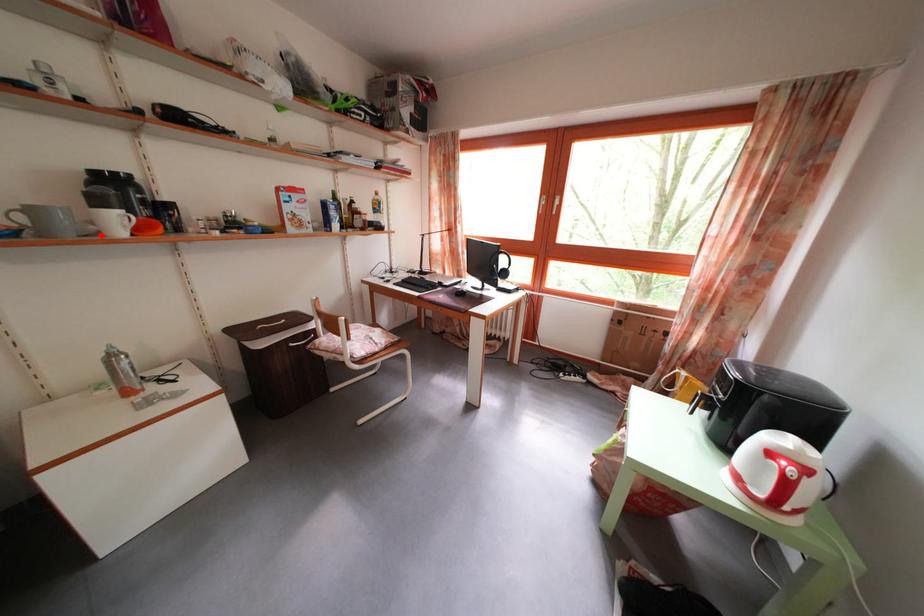
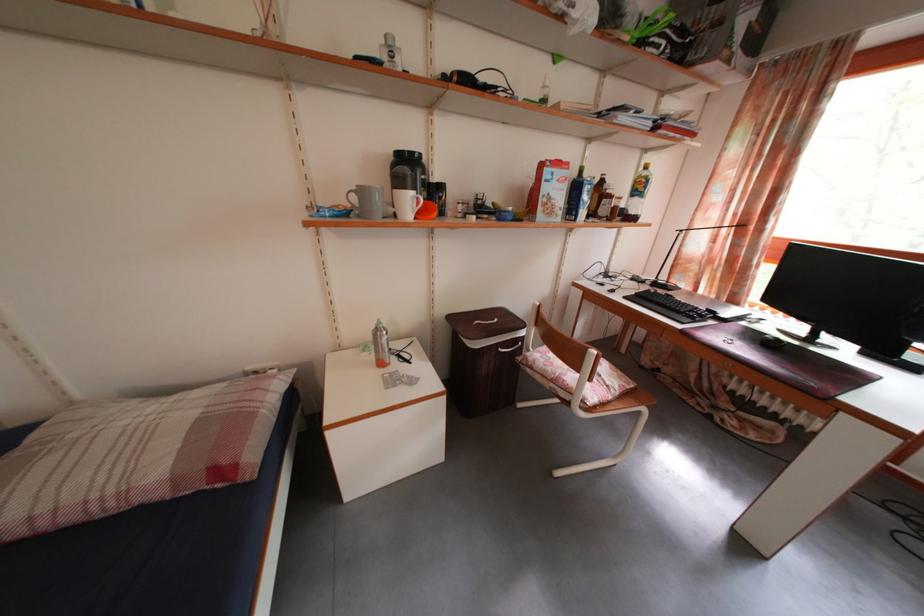
Find the pixel in the second image that matches the highlighted location in the first image.

(398, 217)